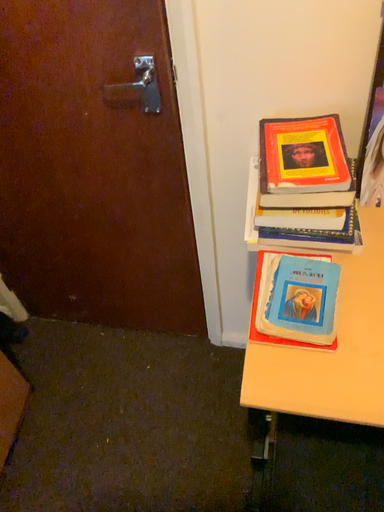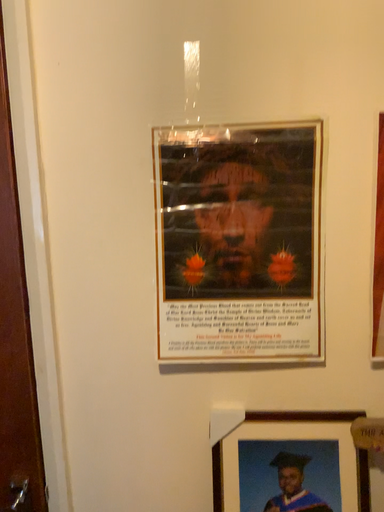
Question: Which way did the camera rotate in the video?

Choices:
 (A) rotated downward
 (B) rotated upward

Answer: (B)